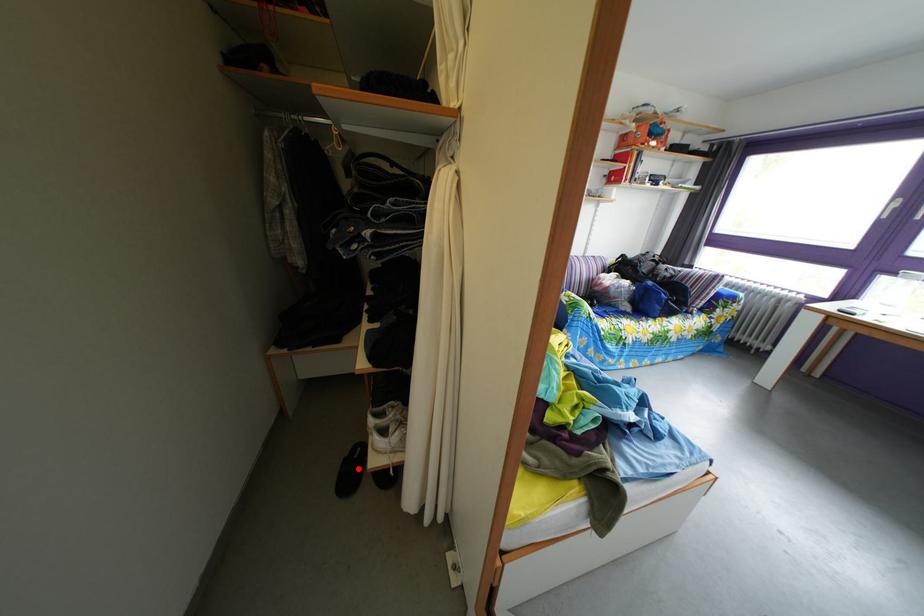
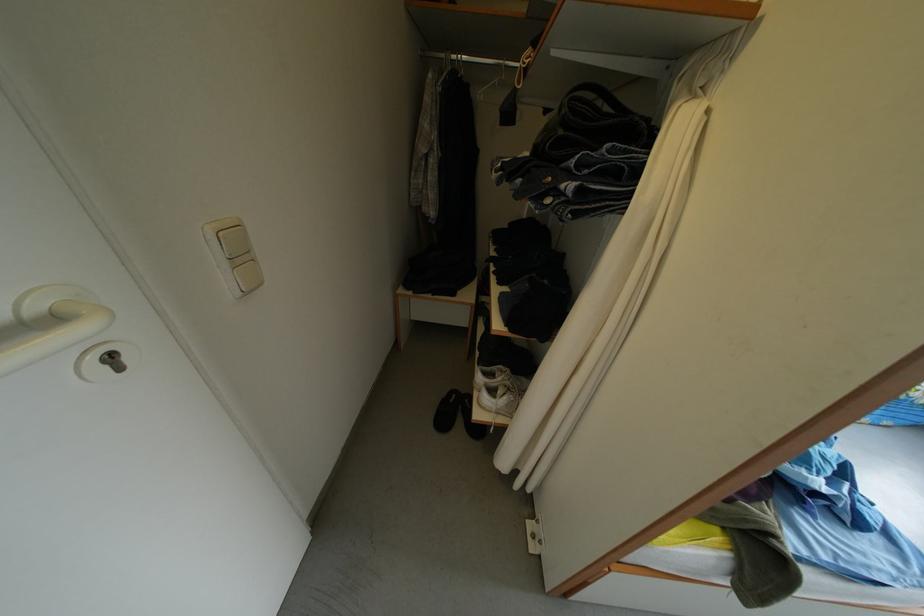
Question: I am providing you with two images of the same scene from different viewpoints. Given a red point in image1, look at the same physical point in image2. Is it:

Choices:
 (A) Closer to the viewpoint
 (B) Farther from the viewpoint

Answer: (A)